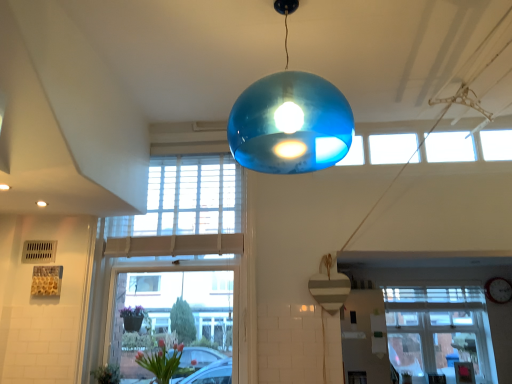
Question: Is white matte exhaust hood at upper left taller than pink glass vase at lower left?

Choices:
 (A) no
 (B) yes

Answer: (A)

Question: Is white matte exhaust hood at upper left smaller than pink glass vase at lower left?

Choices:
 (A) no
 (B) yes

Answer: (A)

Question: Is the depth of white matte exhaust hood at upper left greater than that of pink glass vase at lower left?

Choices:
 (A) yes
 (B) no

Answer: (B)

Question: Are white matte exhaust hood at upper left and pink glass vase at lower left far apart?

Choices:
 (A) no
 (B) yes

Answer: (B)

Question: From a real-world perspective, does white matte exhaust hood at upper left stand above pink glass vase at lower left?

Choices:
 (A) no
 (B) yes

Answer: (B)

Question: Looking at their shapes, would you say pink glass vase at lower left is wider or thinner than white matte exhaust hood at upper left?

Choices:
 (A) thin
 (B) wide

Answer: (A)

Question: Considering their positions, is pink glass vase at lower left located in front of or behind white matte exhaust hood at upper left?

Choices:
 (A) front
 (B) behind

Answer: (B)

Question: Would you say pink glass vase at lower left is inside or outside white matte exhaust hood at upper left?

Choices:
 (A) outside
 (B) inside

Answer: (A)

Question: Is pink glass vase at lower left to the left or to the right of white matte exhaust hood at upper left in the image?

Choices:
 (A) left
 (B) right

Answer: (B)

Question: Is pink glass vase at lower left inside or outside of matte white clock at center?

Choices:
 (A) outside
 (B) inside

Answer: (A)

Question: Is pink glass vase at lower left in front of or behind matte white clock at center in the image?

Choices:
 (A) behind
 (B) front

Answer: (B)

Question: Looking at the image, does pink glass vase at lower left seem bigger or smaller compared to matte white clock at center?

Choices:
 (A) big
 (B) small

Answer: (A)

Question: From a real-world perspective, is pink glass vase at lower left positioned above or below matte white clock at center?

Choices:
 (A) above
 (B) below

Answer: (B)

Question: Looking at their shapes, would you say clear glass window at center, marked as the 2th window in a back-to-front arrangement, is wider or thinner than pink glass vase at lower left?

Choices:
 (A) thin
 (B) wide

Answer: (A)

Question: In the image, is clear glass window at center, the first window when ordered from top to bottom, on the left side or the right side of pink glass vase at lower left?

Choices:
 (A) left
 (B) right

Answer: (A)